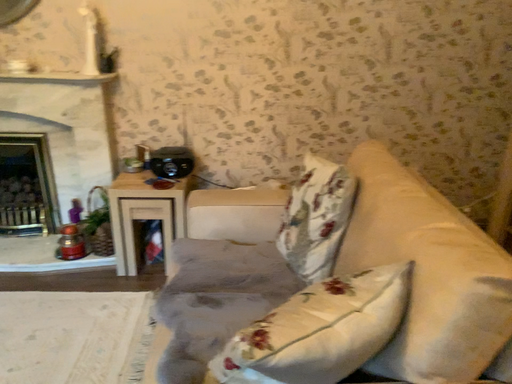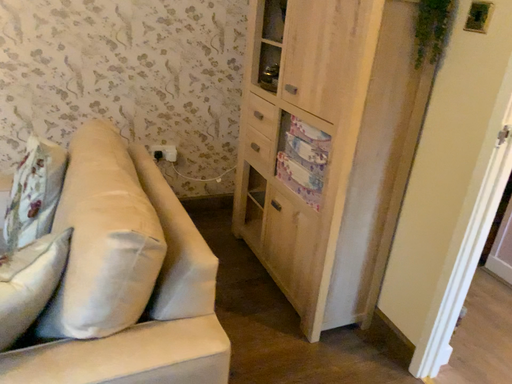
Question: How did the camera likely rotate when shooting the video?

Choices:
 (A) rotated left
 (B) rotated right

Answer: (B)